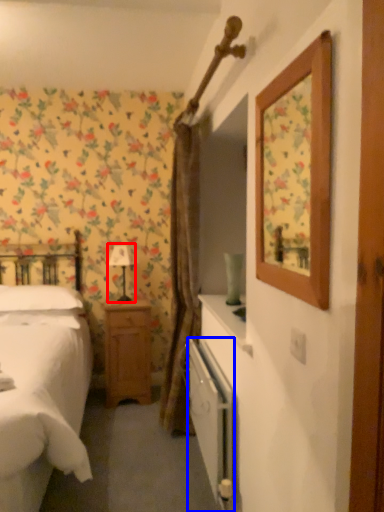
Question: Among these objects, which one is nearest to the camera, table lamp (highlighted by a red box) or radiator (highlighted by a blue box)?

Choices:
 (A) table lamp
 (B) radiator

Answer: (B)